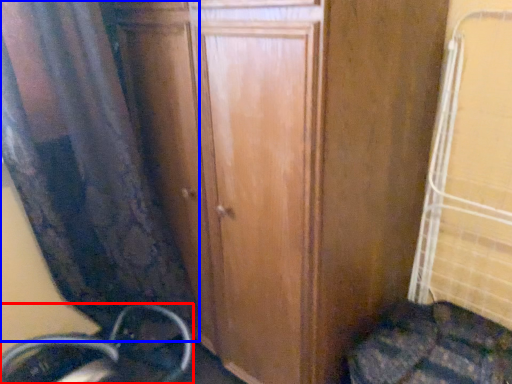
Question: Which object appears closest to the camera in this image, wheel (highlighted by a red box) or curtain (highlighted by a blue box)?

Choices:
 (A) wheel
 (B) curtain

Answer: (B)